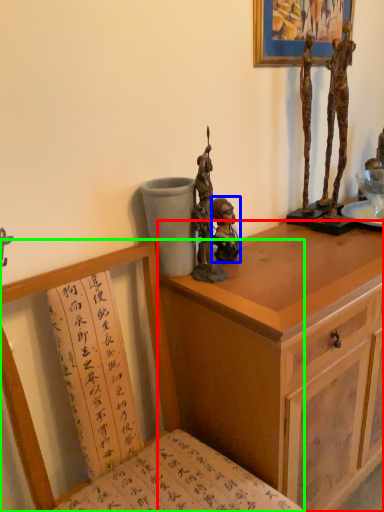
Question: Estimate the real-world distances between objects in this image. Which object is farther from cabinetry (highlighted by a red box), person (highlighted by a blue box) or chair (highlighted by a green box)?

Choices:
 (A) person
 (B) chair

Answer: (A)